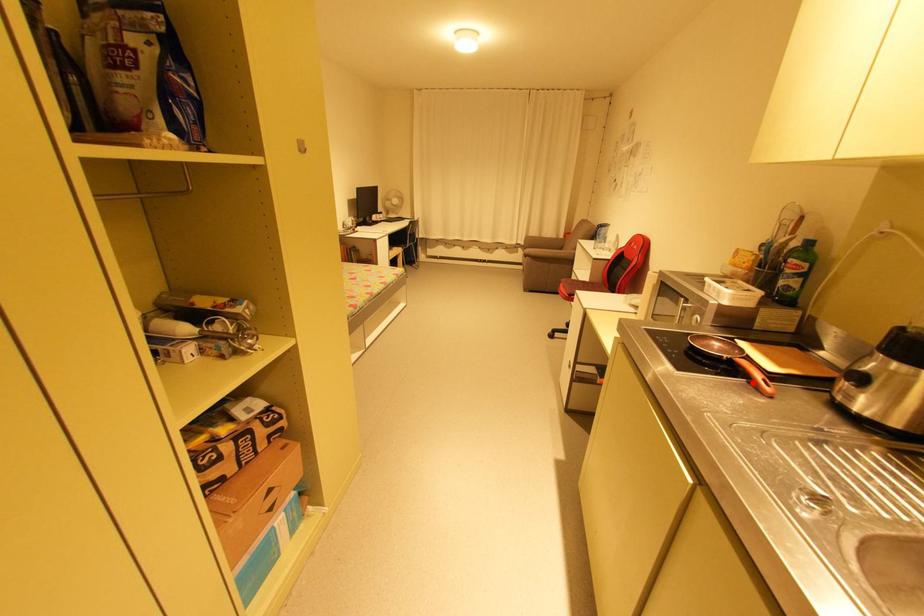
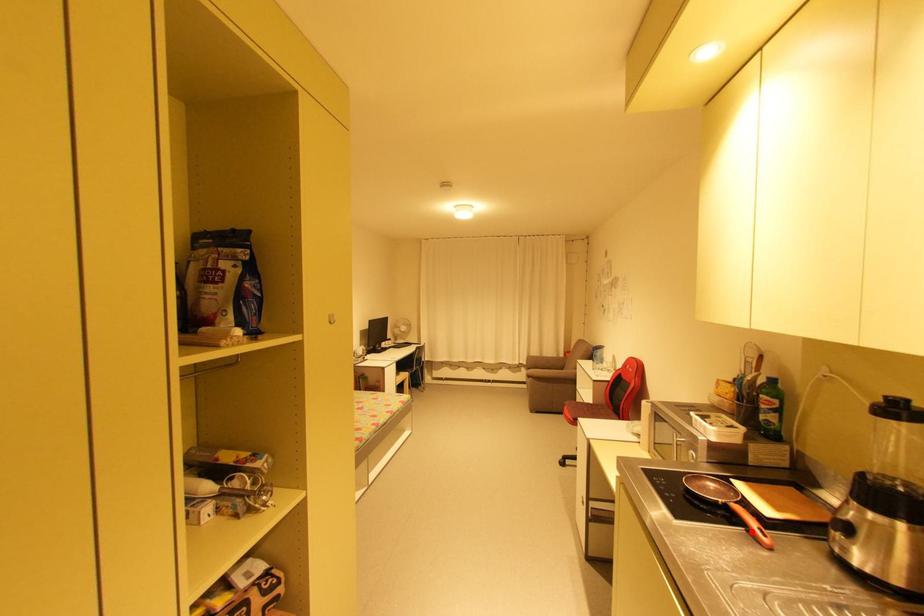
I am providing you with two images of the same scene from different viewpoints. A red point is marked on the first image and another point is marked on the second image. Does the point marked in image1 correspond to the same location as the one in image2?

Yes